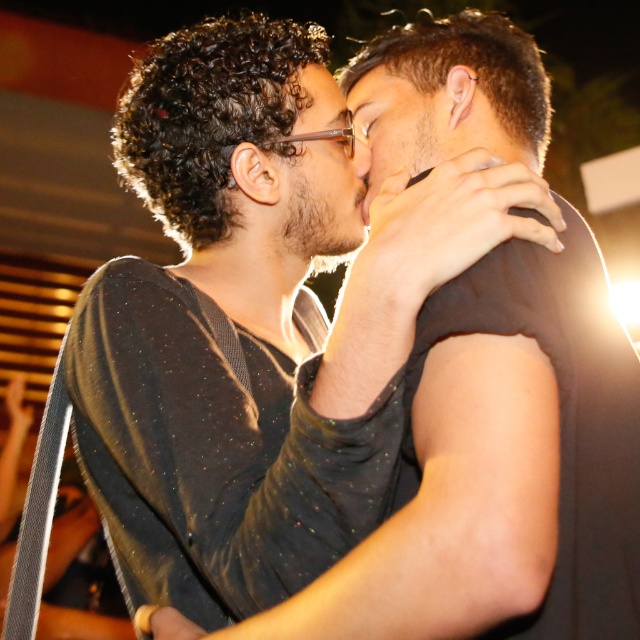
You are a photographer adjusting the focus of your camera. You need to ensure that the matte black face at center is in sharp focus. According to the scene description, where should you position the focus point?

The focus point should be positioned at the coordinates (317, 196) to ensure the matte black face at center is in sharp focus.

You are a photographer adjusting the lighting for a portrait. You need to ensure both matte black face at center and smooth skin face at center are evenly lit. Given their face widths, which face might require more light to appear equally bright?

The matte black face at center has a smaller width than the smooth skin face at center. Since a smaller face may require more light to achieve the same brightness, the matte black face at center might need additional lighting to balance the exposure between both faces.

You are a photographer adjusting your camera settings to capture the scene. You need to ensure both faces are evenly lit. Since the matte black face at center and the smooth skin face at center are positioned differently, which face should you adjust the lighting towards to balance their exposure?

The matte black face at center is to the left of smooth skin face at center. Since matte surfaces reflect less light than smooth surfaces, you should adjust the lighting towards the matte black face at center to ensure it receives more light and balances the exposure with the smooth skin face at center which naturally reflects more light.